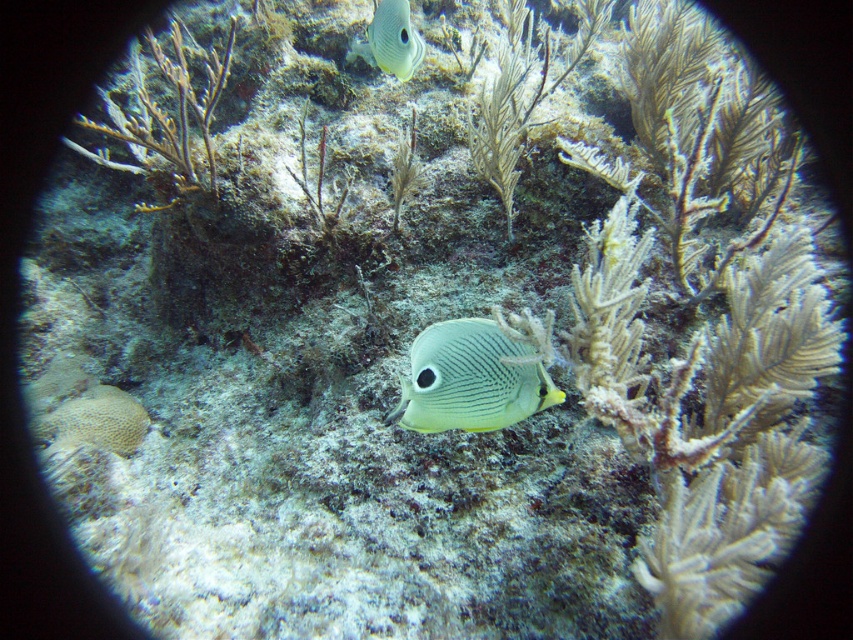
Looking at this image, you are a marine biologist studying underwater life. You have a camera with a rectangular frame that can only capture objects within a 0.3x0.3 area centered at point 0.5,0.5. Will the translucent yellow fish at center be fully inside your camera frame?

The translucent yellow fish at center is located at point (469, 380). The camera frame is centered at (426, 320) with a 0.3x0.3 area. The fish is outside the frame since its coordinates are beyond the frame boundaries.

You are a marine biologist observing two fish in an underwater scene. The scene has a circular lens creating a vignette effect with dark edges. You see a translucent yellow fish at center and a translucent white fish at center. Which fish is bigger?

The translucent yellow fish at center is larger than the translucent white fish at center.

You are a marine biologist observing an underwater scene. You notice two fish, the translucent yellow fish at center and the translucent white fish at center. Which fish is positioned to the right of the other?

The translucent yellow fish at center is positioned to the right of the translucent white fish at center.